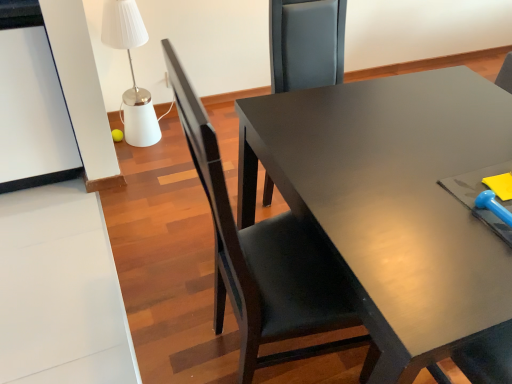
What do you see at coordinates (262, 258) in the screenshot? I see `matte black chair at center` at bounding box center [262, 258].

Where is `matte black chair at center`? The width and height of the screenshot is (512, 384). matte black chair at center is located at coordinates (262, 258).

Measure the distance between point (316, 323) and camera.

Point (316, 323) is 1.05 meters away from camera.

This screenshot has width=512, height=384. What do you see at coordinates (131, 71) in the screenshot?
I see `white glossy table lamp at upper left` at bounding box center [131, 71].

The height and width of the screenshot is (384, 512). What are the coordinates of `white glossy table lamp at upper left` in the screenshot? It's located at [x=131, y=71].

I want to click on matte black chair at center, so click(262, 258).

Is white glossy table lamp at upper left to the right of matte black chair at center from the viewer's perspective?

No, white glossy table lamp at upper left is not to the right of matte black chair at center.

Between white glossy table lamp at upper left and matte black chair at center, which one is positioned in front?

matte black chair at center is more forward.

Between point (125, 91) and point (225, 237), which one is positioned behind?

Point (125, 91)

From the image's perspective, which object appears higher, white glossy table lamp at upper left or matte black chair at center?

white glossy table lamp at upper left.

From a real-world perspective, is white glossy table lamp at upper left on top of matte black chair at center?

No, from a real-world perspective, white glossy table lamp at upper left is not above matte black chair at center.

In terms of width, does white glossy table lamp at upper left look wider or thinner when compared to matte black chair at center?

white glossy table lamp at upper left is thinner than matte black chair at center.

Is white glossy table lamp at upper left taller than matte black chair at center?

In fact, white glossy table lamp at upper left may be shorter than matte black chair at center.

Which of these two, white glossy table lamp at upper left or matte black chair at center, is bigger?

matte black chair at center.

Would you say white glossy table lamp at upper left contains matte black chair at center?

That's incorrect, matte black chair at center is not inside white glossy table lamp at upper left.

Can you see white glossy table lamp at upper left touching matte black chair at center?

No, white glossy table lamp at upper left is not touching matte black chair at center.

Is white glossy table lamp at upper left positioned with its back to matte black chair at center?

No, white glossy table lamp at upper left is not facing the opposite direction of matte black chair at center.

Measure the distance between white glossy table lamp at upper left and matte black chair at center.

1.42 meters.

This screenshot has height=384, width=512. Find the location of `table lamp below the matte black chair at center (from a real-world perspective)`. table lamp below the matte black chair at center (from a real-world perspective) is located at coordinates (131, 71).

Which object is positioned more to the left, matte black chair at center or white glossy table lamp at upper left?

white glossy table lamp at upper left.

Looking at this image, which object is more forward, matte black chair at center or white glossy table lamp at upper left?

matte black chair at center is more forward.

Which is less distant, [278,240] or [154,112]?

Point [278,240] appears to be closer to the viewer than point [154,112].

From the image's perspective, between matte black chair at center and white glossy table lamp at upper left, which one is located above?

white glossy table lamp at upper left is shown above in the image.

From a real-world perspective, who is located lower, matte black chair at center or white glossy table lamp at upper left?

From a 3D spatial view, white glossy table lamp at upper left is below.

Considering the sizes of objects matte black chair at center and white glossy table lamp at upper left in the image provided, who is thinner, matte black chair at center or white glossy table lamp at upper left?

white glossy table lamp at upper left.

Is matte black chair at center taller or shorter than white glossy table lamp at upper left?

Considering their sizes, matte black chair at center has more height than white glossy table lamp at upper left.

Considering the sizes of objects matte black chair at center and white glossy table lamp at upper left in the image provided, who is smaller, matte black chair at center or white glossy table lamp at upper left?

With smaller size is white glossy table lamp at upper left.

Which is correct: matte black chair at center is inside white glossy table lamp at upper left, or outside of it?

matte black chair at center is not inside white glossy table lamp at upper left, it's outside.

Does matte black chair at center touch white glossy table lamp at upper left?

No.

Does matte black chair at center turn towards white glossy table lamp at upper left?

No.

What's the angular difference between matte black chair at center and white glossy table lamp at upper left's facing directions?

The angle between the facing direction of matte black chair at center and the facing direction of white glossy table lamp at upper left is 92.1 degrees.

Measure the distance between matte black chair at center and white glossy table lamp at upper left.

The distance of matte black chair at center from white glossy table lamp at upper left is 4.67 feet.

Where is `table lamp below the matte black chair at center (from a real-world perspective)`? table lamp below the matte black chair at center (from a real-world perspective) is located at coordinates (131, 71).

Locate an element on the screen. The height and width of the screenshot is (384, 512). chair on the right of the white glossy table lamp at upper left is located at coordinates (262, 258).

Find the location of `chair that is above the white glossy table lamp at upper left (from a real-world perspective)`. chair that is above the white glossy table lamp at upper left (from a real-world perspective) is located at coordinates point(262,258).